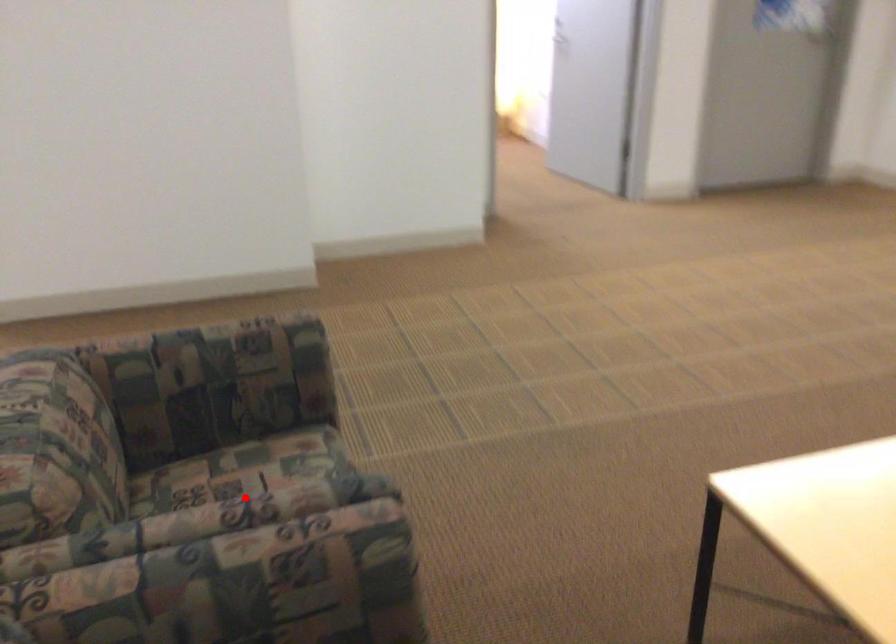
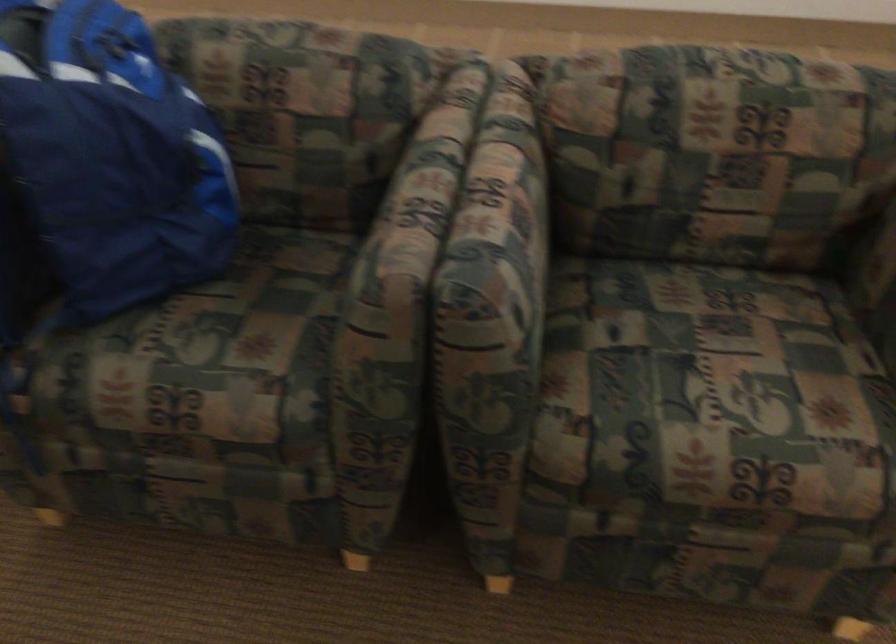
Question: A red point is marked in image1. In image2, is the corresponding 3D point closer to the camera or farther? Reply with the corresponding letter.

Choices:
 (A) The corresponding 3D point is closer.
 (B) The corresponding 3D point is farther.

Answer: (A)